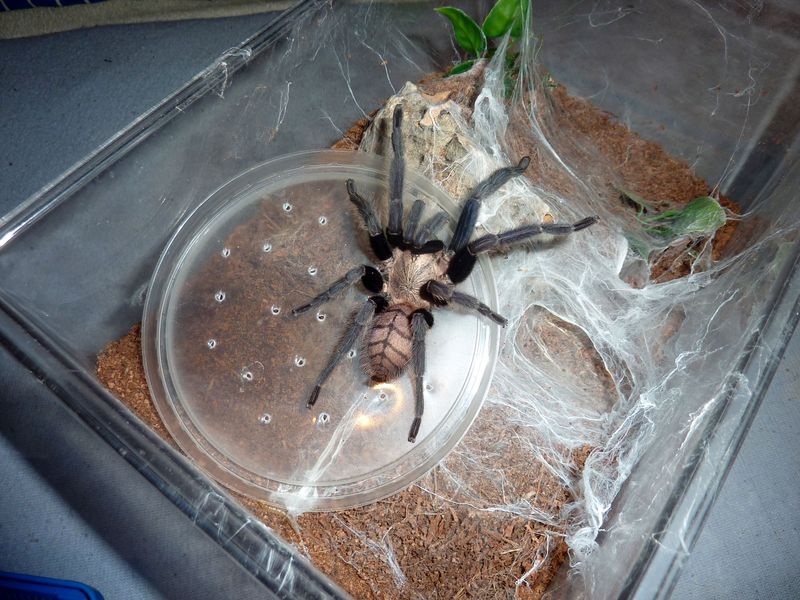
Where is `blue grey table`? This screenshot has height=600, width=800. blue grey table is located at coordinates (770, 519), (74, 84), (34, 509).